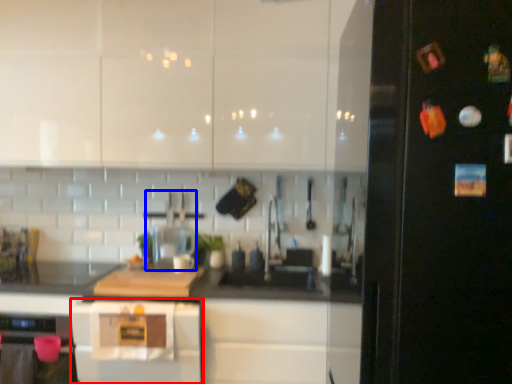
Question: Which point is further to the camera, home appliance (highlighted by a red box) or appliance (highlighted by a blue box)?

Choices:
 (A) home appliance
 (B) appliance

Answer: (B)